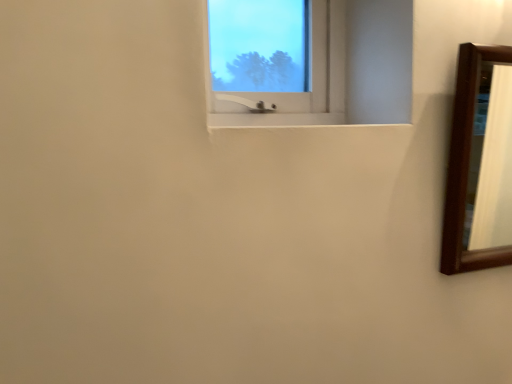
Question: Is transparent glass window at upper center to the left or to the right of brown wooden mirror at right in the image?

Choices:
 (A) left
 (B) right

Answer: (A)

Question: Is transparent glass window at upper center inside or outside of brown wooden mirror at right?

Choices:
 (A) outside
 (B) inside

Answer: (A)

Question: Considering the positions of transparent glass window at upper center and brown wooden mirror at right in the image, is transparent glass window at upper center wider or thinner than brown wooden mirror at right?

Choices:
 (A) thin
 (B) wide

Answer: (A)

Question: Do you think brown wooden mirror at right is within transparent glass window at upper center, or outside of it?

Choices:
 (A) outside
 (B) inside

Answer: (A)

Question: In terms of width, does brown wooden mirror at right look wider or thinner when compared to transparent glass window at upper center?

Choices:
 (A) thin
 (B) wide

Answer: (B)

Question: Based on their positions, is brown wooden mirror at right located to the left or right of transparent glass window at upper center?

Choices:
 (A) left
 (B) right

Answer: (B)

Question: Relative to transparent glass window at upper center, is brown wooden mirror at right in front or behind?

Choices:
 (A) front
 (B) behind

Answer: (B)